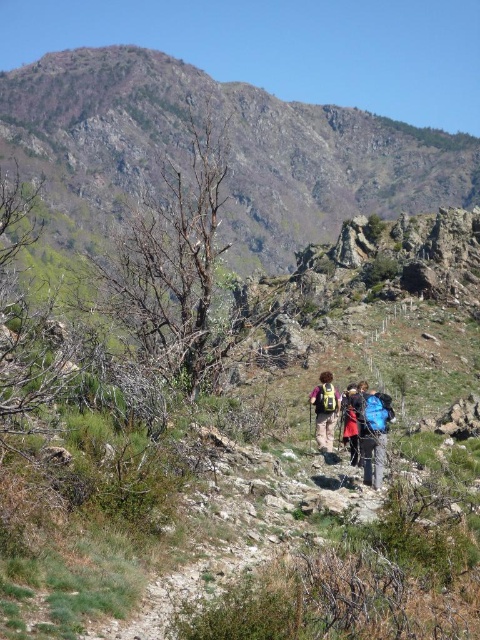
You are planning to carry both the blue fabric backpack at center and the yellow backpack at center on a hike. Based on the scene, which backpack might have a larger width?

The blue fabric backpack at center might be wider than the yellow backpack at center according to the scene description.

You are a hiker planning to carry both the blue fabric backpack at center and the yellow backpack at center. Which backpack should you choose if you want the one that is taller?

The yellow backpack at center is taller than the blue fabric backpack at center, so you should choose the yellow backpack at center.